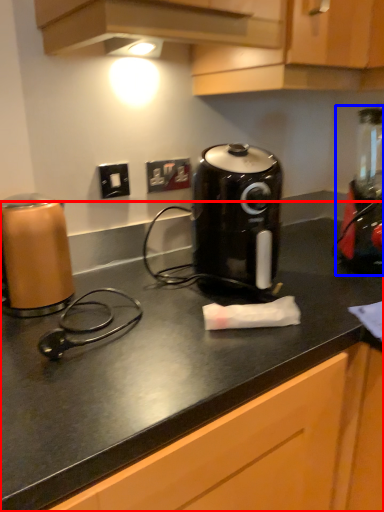
Question: Which of the following is the farthest to the observer, counter (highlighted by a red box) or blender (highlighted by a blue box)?

Choices:
 (A) counter
 (B) blender

Answer: (B)